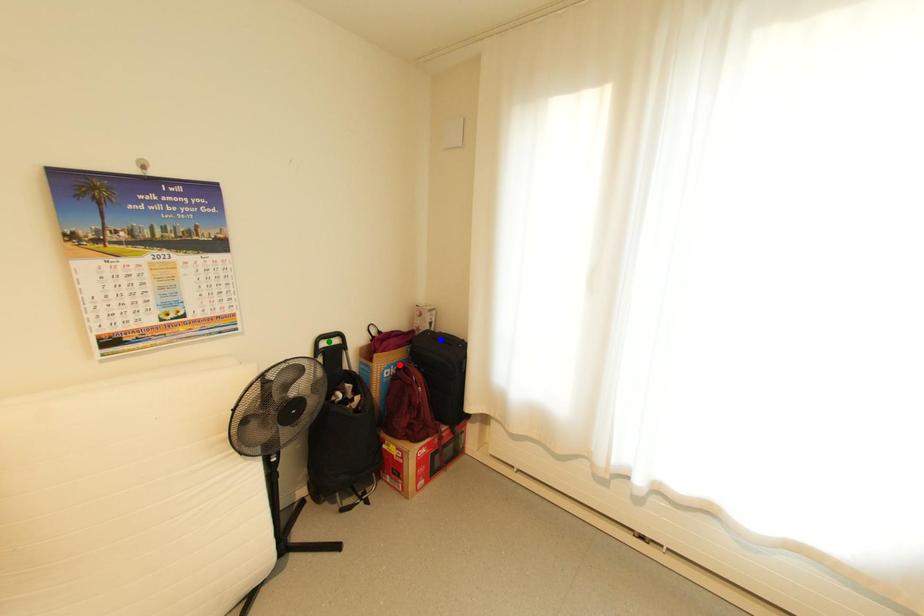
Order these from nearest to farthest:
- red point
- blue point
- green point

1. green point
2. red point
3. blue point